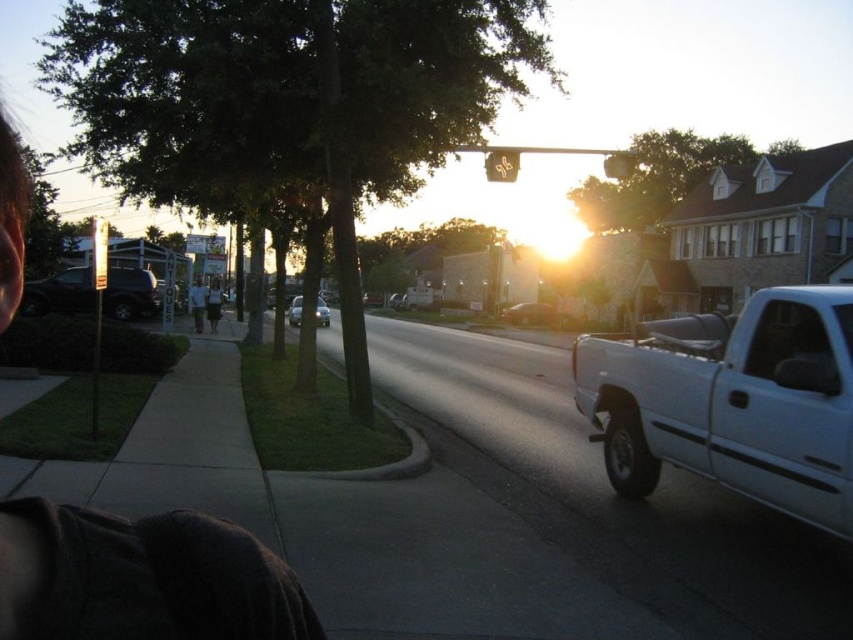
Can you confirm if matte black suv at left is positioned above metallic silver sedan at center?

Indeed, matte black suv at left is positioned over metallic silver sedan at center.

Does matte black suv at left appear under metallic silver sedan at center?

Actually, matte black suv at left is above metallic silver sedan at center.

The height and width of the screenshot is (640, 853). Find the location of `matte black suv at left`. matte black suv at left is located at coordinates (59, 292).

Does metallic yellow traffic light at upper center have a smaller size compared to white cotton dress at center?

No.

Who is more forward, (x=618, y=152) or (x=212, y=298)?

Point (x=618, y=152)

This screenshot has width=853, height=640. What are the coordinates of `metallic yellow traffic light at upper center` in the screenshot? It's located at (619, 164).

Which is in front, point (601, 384) or point (320, 323)?

Positioned in front is point (601, 384).

Does white matte truck at right appear on the left side of shiny silver sedan at center?

In fact, white matte truck at right is to the right of shiny silver sedan at center.

Where is `white matte truck at right`? The height and width of the screenshot is (640, 853). white matte truck at right is located at coordinates (732, 401).

Where is `white matte truck at right`? This screenshot has width=853, height=640. white matte truck at right is located at coordinates (732, 401).